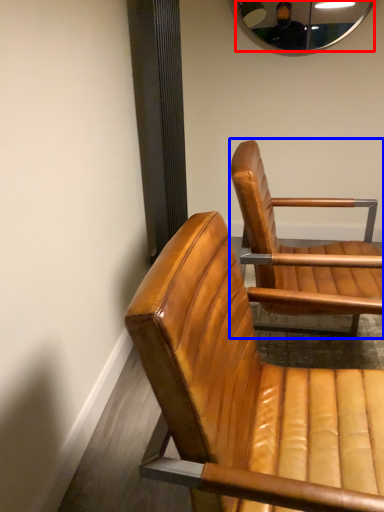
Question: Which object is closer to the camera taking this photo, mirror (highlighted by a red box) or chair (highlighted by a blue box)?

Choices:
 (A) mirror
 (B) chair

Answer: (B)